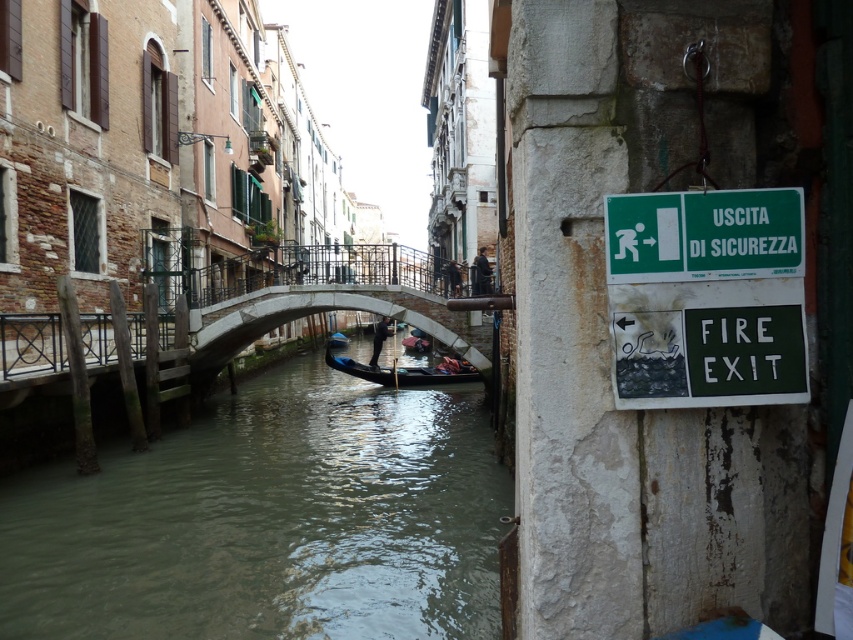
Which is in front, point (787, 241) or point (390, 380)?

Point (787, 241)

You are a GUI agent. You are given a task and a screenshot of the screen. Output one action in this format:
    pyautogui.click(x=<x>, y=<y>)
    Task: Click on the green plastic sign at upper right
    
    Given the screenshot: What is the action you would take?
    pyautogui.click(x=704, y=234)

Does wooden gondola at center have a larger size compared to blue glossy boat at center?

Yes, wooden gondola at center is bigger than blue glossy boat at center.

In order to click on wooden gondola at center in this screenshot , I will do `click(405, 369)`.

Which is more to the left, greenish water at center or green plastic sign at upper right?

Positioned to the left is greenish water at center.

Can you confirm if greenish water at center is smaller than green plastic sign at upper right?

Actually, greenish water at center might be larger than green plastic sign at upper right.

You are a GUI agent. You are given a task and a screenshot of the screen. Output one action in this format:
    pyautogui.click(x=<x>, y=<y>)
    Task: Click on the greenish water at center
    
    Given the screenshot: What is the action you would take?
    pyautogui.click(x=270, y=520)

This screenshot has height=640, width=853. Identify the location of greenish water at center. (270, 520).